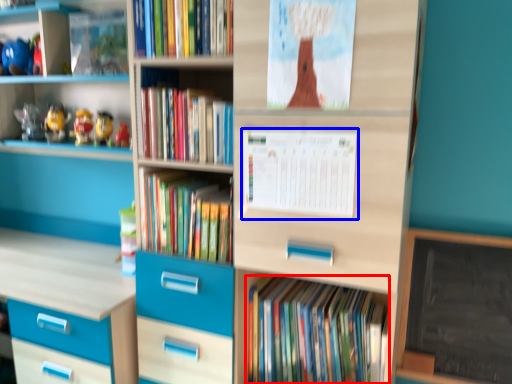
Question: Which point is closer to the camera, book (highlighted by a red box) or paperback book (highlighted by a blue box)?

Choices:
 (A) book
 (B) paperback book

Answer: (B)